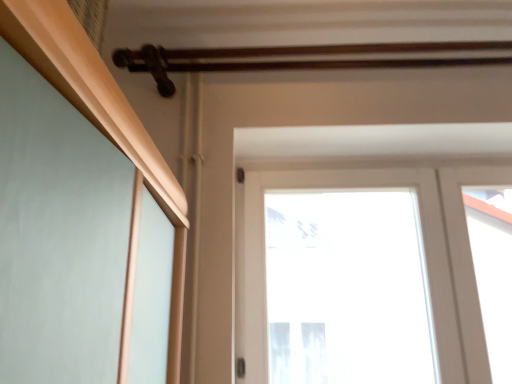
In order to face transparent glass window at upper center, should I rotate leftwards or rightwards?

You should rotate right by 20.411 degrees.

I want to click on transparent glass window at upper center, so click(424, 256).

The height and width of the screenshot is (384, 512). What do you see at coordinates (424, 256) in the screenshot? I see `transparent glass window at upper center` at bounding box center [424, 256].

You are a GUI agent. You are given a task and a screenshot of the screen. Output one action in this format:
    pyautogui.click(x=<x>, y=<y>)
    Task: Click on the transparent glass window at upper center
    This screenshot has height=384, width=512.
    Given the screenshot: What is the action you would take?
    pyautogui.click(x=424, y=256)